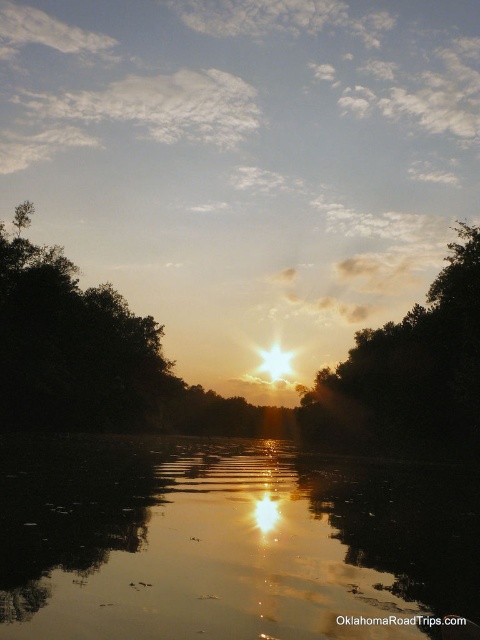
Who is taller, glistening reflective water at center or dark green leafy tree at left?

dark green leafy tree at left is taller.

Does glistening reflective water at center appear over dark green leafy tree at left?

Incorrect, glistening reflective water at center is not positioned above dark green leafy tree at left.

Does point (186, 632) come in front of point (105, 413)?

That is True.

Locate an element on the screen. glistening reflective water at center is located at coordinates (228, 541).

Based on the photo, can you confirm if glistening reflective water at center is wider than dark green leafy tree at center?

Yes.

Which is behind, point (380, 509) or point (364, 349)?

Point (364, 349)

Where is `glistening reflective water at center`? This screenshot has width=480, height=640. glistening reflective water at center is located at coordinates (228, 541).

Does dark green leafy tree at left appear on the left side of dark green leafy tree at center?

Correct, you'll find dark green leafy tree at left to the left of dark green leafy tree at center.

Between point (48, 273) and point (476, 360), which one is positioned in front?

Point (476, 360) is in front.

Locate an element on the screen. dark green leafy tree at left is located at coordinates (73, 348).